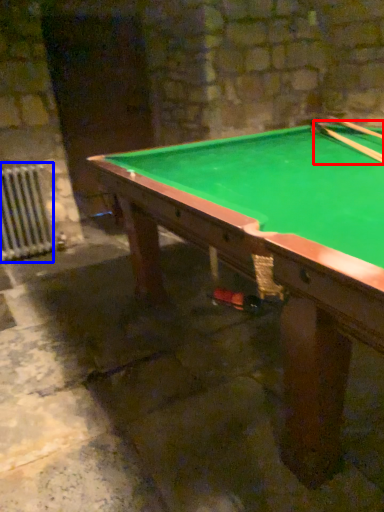
Question: Which object is further to the camera taking this photo, cue (highlighted by a red box) or radiator (highlighted by a blue box)?

Choices:
 (A) cue
 (B) radiator

Answer: (B)